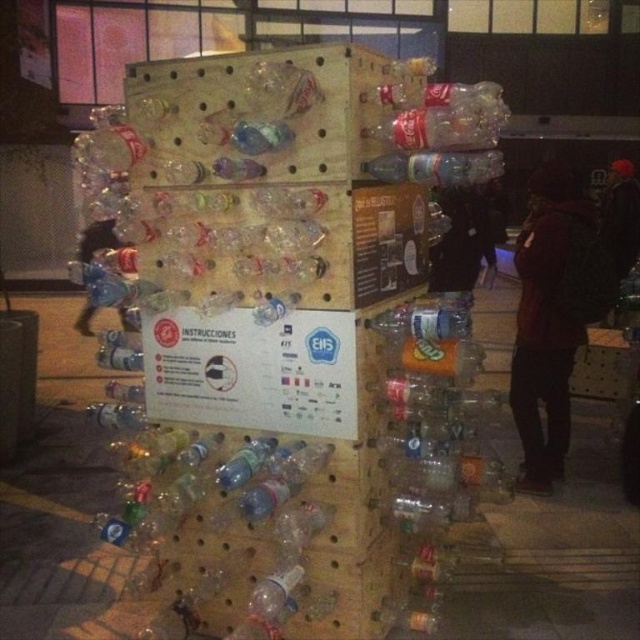
You are an artist who wants to place a new object between the dark red hoodie at center and the clear plastic bottle at center. Which object should you choose to maintain the size relationship between them? The options are a small keychain or a large backpack.

You should choose the small keychain because the dark red hoodie at center is larger than the clear plastic bottle at center. To maintain the size relationship, the new object should be smaller than the hoodie and larger than the bottle. However, since the small keychain is smaller than both, it won not fit the requirement. Wait, actually, the question might be better phrased. Let me think again. The current size relationship is hoodie > bottle. If you want to place a new object between them, the new object